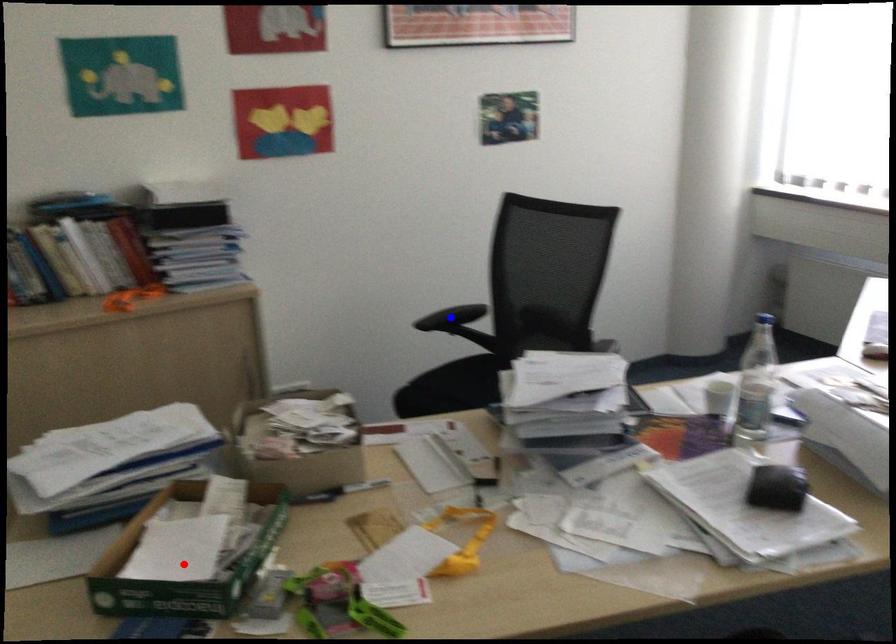
Question: In the image, two points are highlighted. Which point is nearer to the camera? Reply with the corresponding letter.

Choices:
 (A) blue point
 (B) red point

Answer: (B)